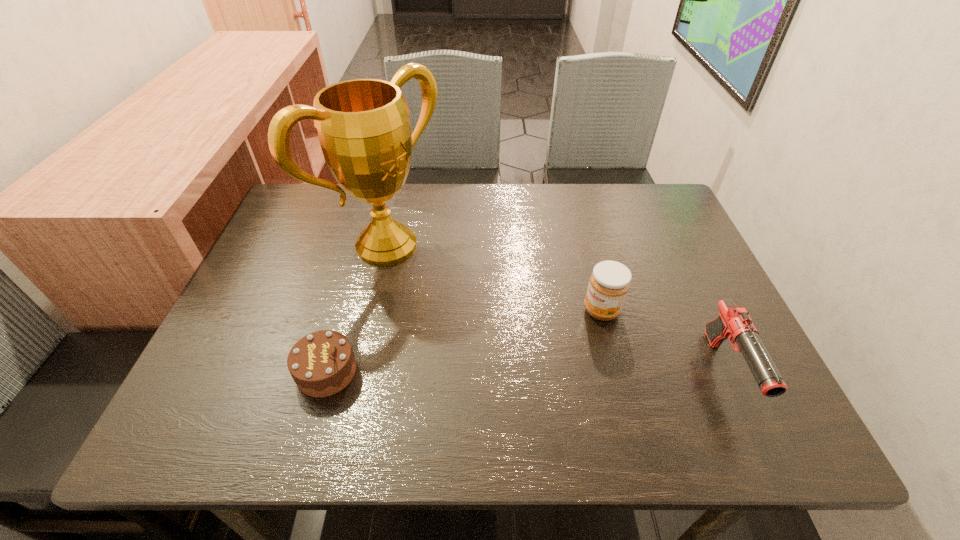
Find the location of a particular element. The width and height of the screenshot is (960, 540). the shortest object is located at coordinates (322, 363).

Find the location of a particular element. the rightmost object is located at coordinates (734, 323).

Locate an element on the screen. This screenshot has width=960, height=540. award is located at coordinates (363, 126).

Locate an element on the screen. This screenshot has height=540, width=960. the tallest object is located at coordinates (363, 126).

At what (x,y) coordinates should I click in order to perform the action: click on jam. Please return your answer as a coordinate pair (x, y). Looking at the image, I should click on (610, 281).

The height and width of the screenshot is (540, 960). I want to click on the third nearest object, so click(610, 281).

This screenshot has width=960, height=540. In order to click on vacant space situated 0.140m on the left of the chocolate cake in this screenshot , I will do (228, 372).

At what (x,y) coordinates should I click in order to perform the action: click on vacant space located on the front-facing side of the farthest object. Please return your answer as a coordinate pair (x, y). Looking at the image, I should click on (538, 352).

I want to click on free space located on the front-facing side of the farthest object, so click(501, 327).

The height and width of the screenshot is (540, 960). Find the location of `free space located on the front-facing side of the farthest object`. free space located on the front-facing side of the farthest object is located at coordinates (459, 298).